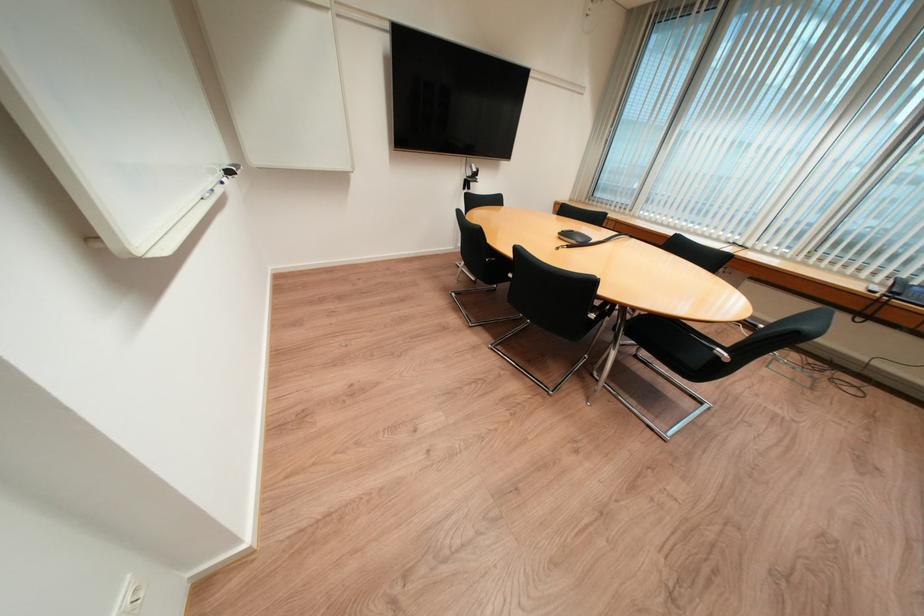
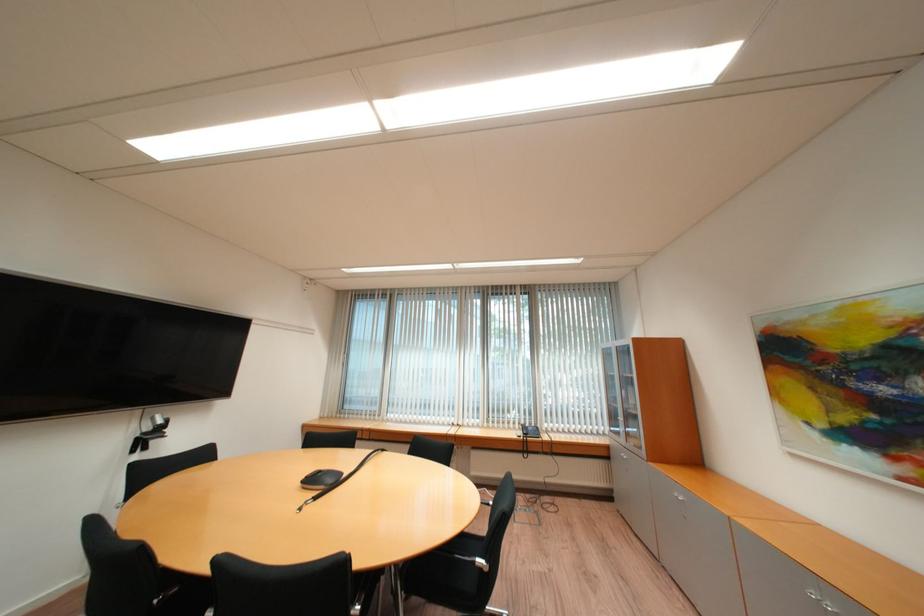
The point at [726,351] is marked in the first image. Where is the corresponding point in the second image?

(487, 561)